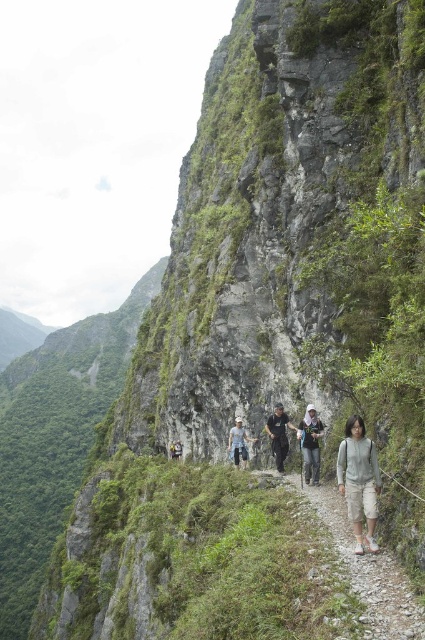
You are a hiker trying to find your backpack. You are currently standing at the origin point of the coordinate system. Where is your light brown fabric backpack at center located in coordinates?

The light brown fabric backpack at center is located at coordinates point (311, 444).

You are a hiker planning to walk along the dusty gravel path at center while carrying the light brown fabric backpack at center. Considering their sizes, will the backpack fit comfortably on your back without protruding beyond the path width?

The dusty gravel path at center is larger in size than the light brown fabric backpack at center, so the backpack will fit comfortably on your back without protruding beyond the path width.